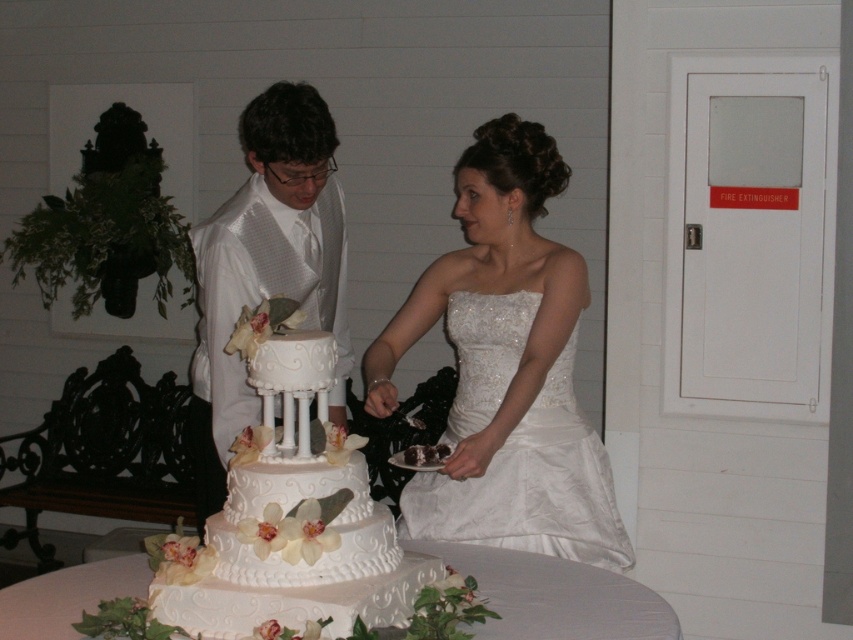
Can you confirm if white glossy wedding cake at center is taller than white satin suit at center?

In fact, white glossy wedding cake at center may be shorter than white satin suit at center.

Between white glossy wedding cake at center and white satin suit at center, which one appears on the left side from the viewer's perspective?

Positioned to the left is white satin suit at center.

Locate an element on the screen. white glossy wedding cake at center is located at coordinates (294, 520).

Can you confirm if white glossy wedding cake at center is bigger than white textured cake at center?

Yes, white glossy wedding cake at center is bigger than white textured cake at center.

Which is above, white glossy wedding cake at center or white textured cake at center?

white glossy wedding cake at center is higher up.

Between point (299, 576) and point (65, 621), which one is positioned behind?

The point (65, 621) is behind.

This screenshot has width=853, height=640. Find the location of `white glossy wedding cake at center`. white glossy wedding cake at center is located at coordinates (294, 520).

Can you confirm if white satin dress at center is thinner than white textured cake at center?

No.

Looking at this image, who is positioned more to the left, white satin dress at center or white textured cake at center?

white satin dress at center is more to the left.

Does point (518, 356) come farther from viewer compared to point (668, 612)?

Yes, point (518, 356) is farther from viewer.

Locate an element on the screen. The image size is (853, 640). white satin dress at center is located at coordinates (506, 368).